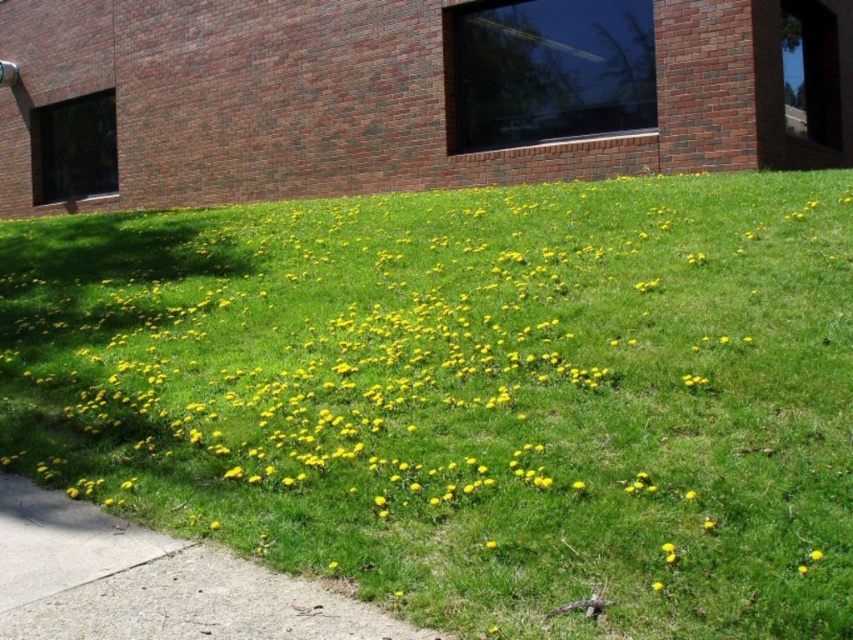
Question: Among these points, which one is farthest from the camera?

Choices:
 (A) (811, 552)
 (B) (19, 630)
 (C) (616, 552)

Answer: (C)

Question: Is gray concrete sidewalk at lower left to the left of yellow soft dandelion at center from the viewer's perspective?

Choices:
 (A) no
 (B) yes

Answer: (B)

Question: Estimate the real-world distances between objects in this image. Which object is closer to the yellow matte flower at center?

Choices:
 (A) green grass at center
 (B) gray concrete sidewalk at lower left
 (C) yellow soft dandelion at center

Answer: (C)

Question: Is green grass at center positioned in front of yellow matte flower at center?

Choices:
 (A) yes
 (B) no

Answer: (A)

Question: Based on their relative distances, which object is nearer to the yellow matte flower at center?

Choices:
 (A) green grass at center
 (B) yellow soft dandelion at center

Answer: (B)

Question: Does gray concrete sidewalk at lower left have a lesser width compared to yellow soft dandelion at center?

Choices:
 (A) yes
 (B) no

Answer: (B)